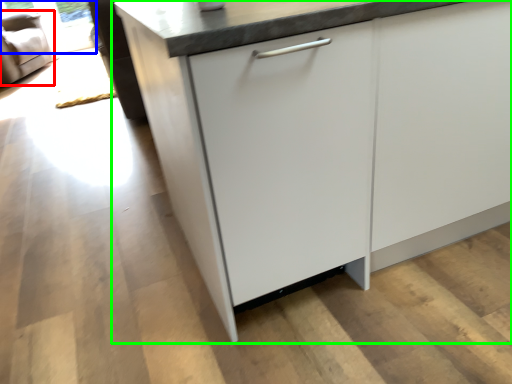
Question: Which object is positioned farthest from armchair (highlighted by a red box)? Select from window screen (highlighted by a blue box) and cabinetry (highlighted by a green box).

Choices:
 (A) window screen
 (B) cabinetry

Answer: (B)